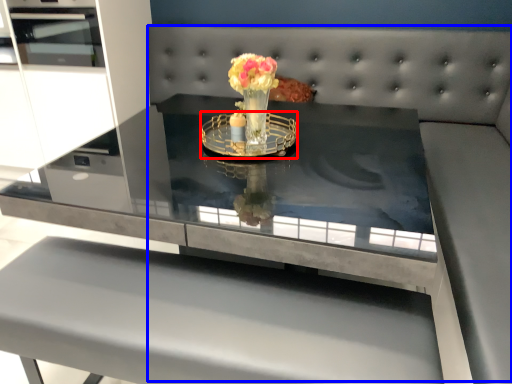
Question: Which object is further to the camera taking this photo, glass plate (highlighted by a red box) or couch (highlighted by a blue box)?

Choices:
 (A) glass plate
 (B) couch

Answer: (A)